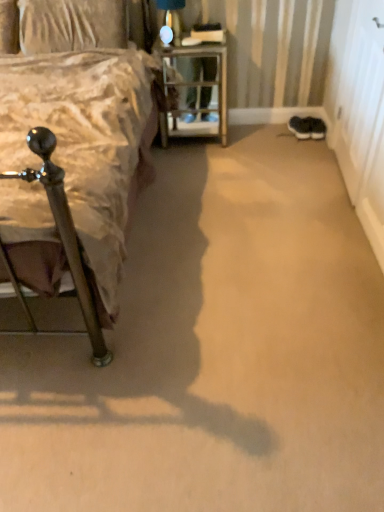
The width and height of the screenshot is (384, 512). What are the coordinates of `vacant space positioned to the left of white wood screen door at right` in the screenshot? It's located at (290, 168).